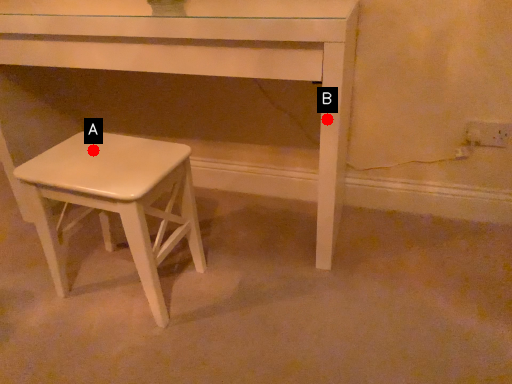
Question: Two points are circled on the image, labeled by A and B beside each circle. Among these points, which one is farthest from the camera?

Choices:
 (A) A is further
 (B) B is further

Answer: (A)